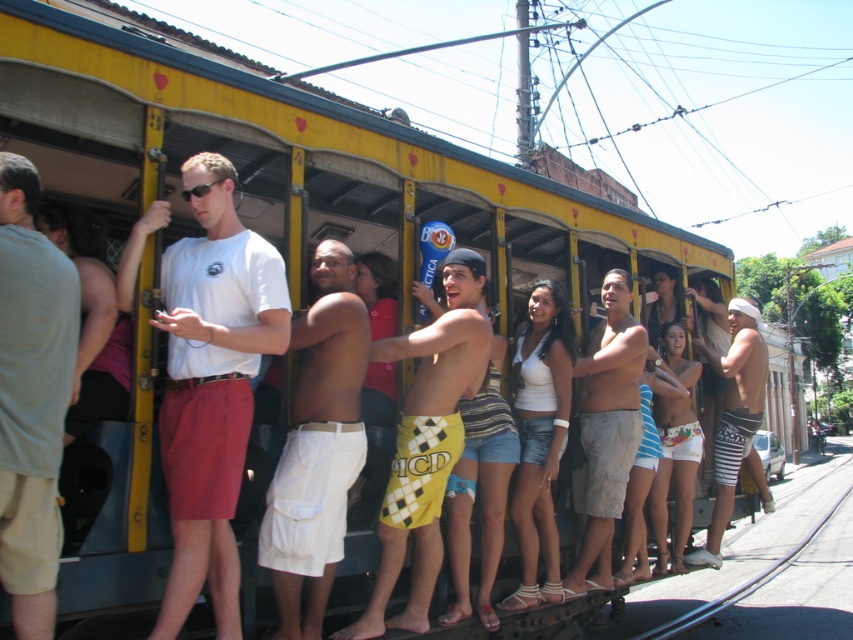
You are standing at the starting point of the metallic gray train track at lower right. Which direction should you walk to board the tram?

The metallic gray train track at lower right is located at point (782,576), so you should walk towards the tram along the track to board it.